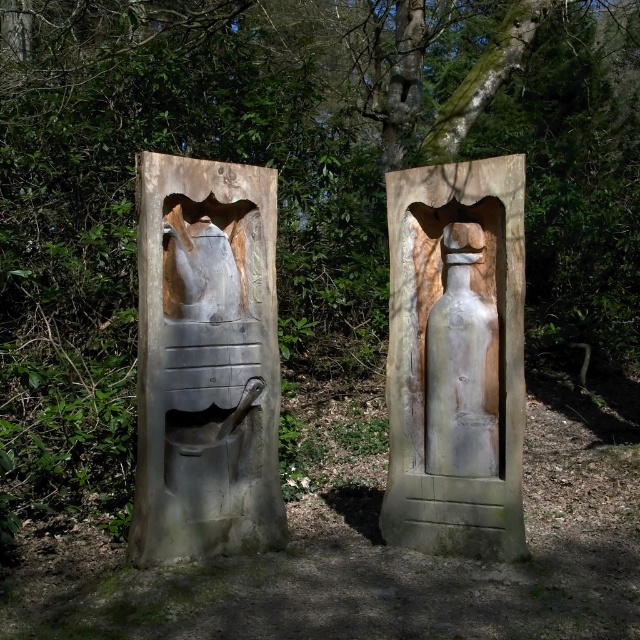
Question: Estimate the real-world distances between objects in this image. Which object is farther from the white stone bottle at center?

Choices:
 (A) matte gray stone pitcher at center
 (B) white matte bottle at center

Answer: (A)

Question: Considering the relative positions of white stone bottle at center and white matte bottle at center in the image provided, where is white stone bottle at center located with respect to white matte bottle at center?

Choices:
 (A) right
 (B) left

Answer: (B)

Question: Which of the following is the farthest from the observer?

Choices:
 (A) matte gray stone pitcher at center
 (B) white matte bottle at center
 (C) white stone bottle at center

Answer: (B)

Question: Is matte gray stone pitcher at center positioned behind white matte bottle at center?

Choices:
 (A) no
 (B) yes

Answer: (A)

Question: Does matte gray stone pitcher at center have a lesser width compared to white stone bottle at center?

Choices:
 (A) no
 (B) yes

Answer: (A)

Question: Among these objects, which one is farthest from the camera?

Choices:
 (A) white matte bottle at center
 (B) white stone bottle at center
 (C) matte gray stone pitcher at center

Answer: (A)